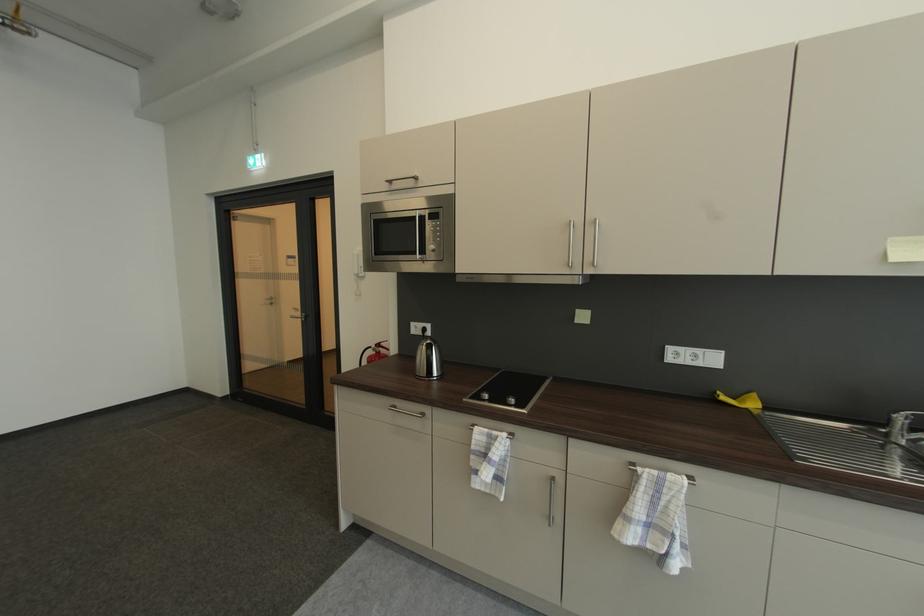
Identify the location of fire extinguisher lever. (379, 351).